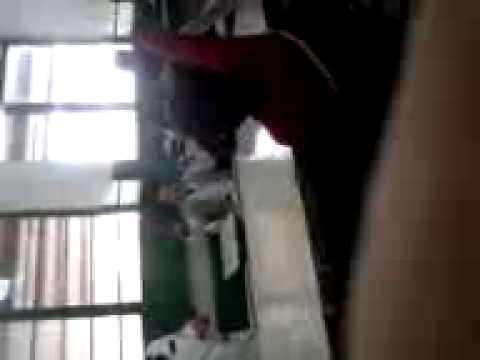
In order to click on window in this screenshot , I will do `click(59, 347)`, `click(73, 277)`, `click(70, 150)`, `click(91, 66)`.